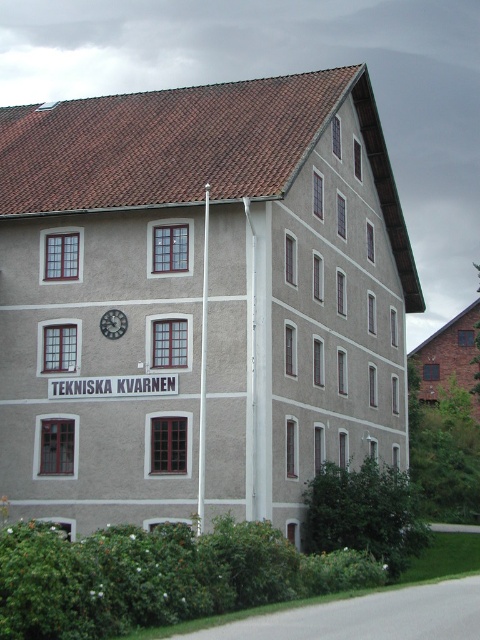
Question: Where is white plastic pole at center located in relation to metallic clock at center in the image?

Choices:
 (A) right
 (B) left

Answer: (A)

Question: Is white plastic pole at center wider than metallic clock at center?

Choices:
 (A) yes
 (B) no

Answer: (B)

Question: Where is white plastic pole at center located in relation to metallic clock at center in the image?

Choices:
 (A) above
 (B) below

Answer: (B)

Question: Which point is closer to the camera?

Choices:
 (A) (107, 310)
 (B) (205, 333)

Answer: (B)